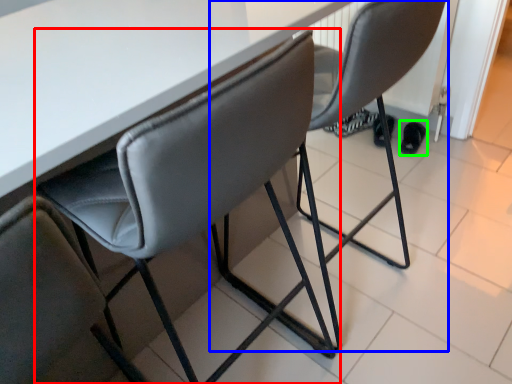
Question: Estimate the real-world distances between objects in this image. Which object is farther from chair (highlighted by a red box), chair (highlighted by a blue box) or footwear (highlighted by a green box)?

Choices:
 (A) chair
 (B) footwear

Answer: (B)